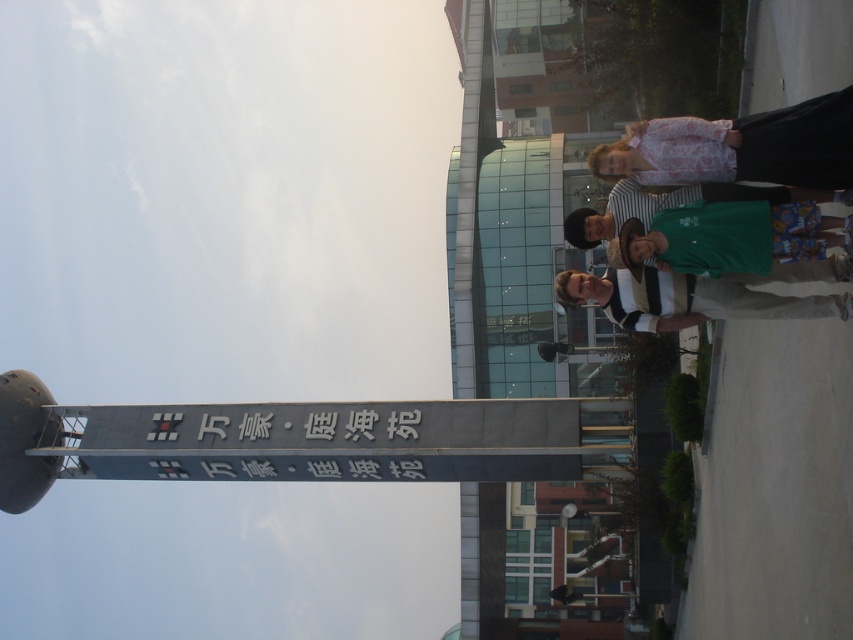
Who is positioned more to the left, pink floral shirt at upper right or green fabric shirt at right?

From the viewer's perspective, green fabric shirt at right appears more on the left side.

Does pink floral shirt at upper right have a smaller size compared to green fabric shirt at right?

No, pink floral shirt at upper right is not smaller than green fabric shirt at right.

Between point (753, 148) and point (573, 230), which one is positioned behind?

Positioned behind is point (573, 230).

The image size is (853, 640). In order to click on pink floral shirt at upper right in this screenshot , I will do `click(740, 147)`.

Which is more to the left, pink floral shirt at upper right or green fabric shirt at center?

→ green fabric shirt at center is more to the left.

Is point (666, 177) less distant than point (674, 246)?

No, it is not.

Describe the element at coordinates (740, 147) in the screenshot. The image size is (853, 640). I see `pink floral shirt at upper right` at that location.

Image resolution: width=853 pixels, height=640 pixels. In order to click on pink floral shirt at upper right in this screenshot , I will do pos(740,147).

Can you confirm if pink floral shirt at upper right is positioned below green cotton shirt at center?

No, pink floral shirt at upper right is not below green cotton shirt at center.

Is pink floral shirt at upper right to the left of green cotton shirt at center from the viewer's perspective?

No, pink floral shirt at upper right is not to the left of green cotton shirt at center.

Is point (763, 152) positioned in front of point (663, 282)?

Yes, it is.

The width and height of the screenshot is (853, 640). I want to click on pink floral shirt at upper right, so point(740,147).